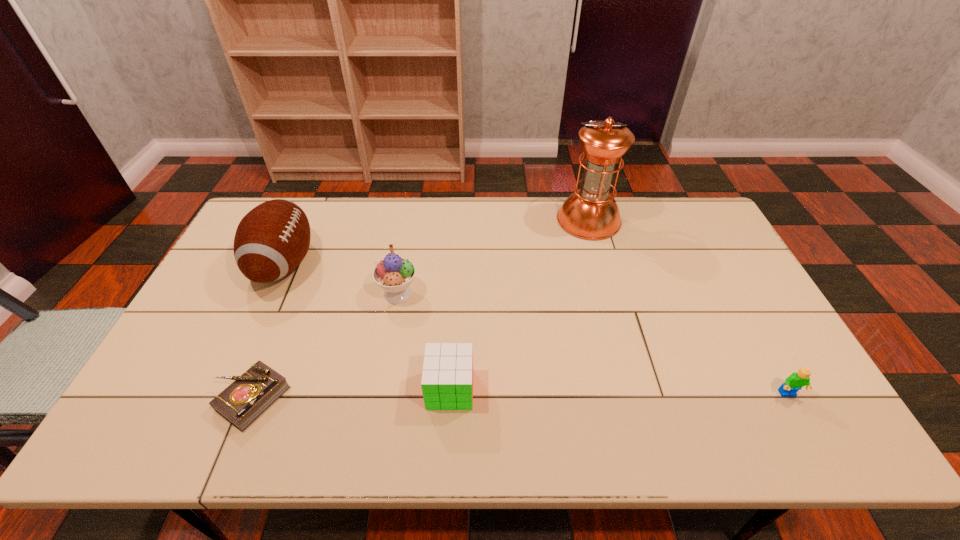
Where is `the second object from right to left`? The width and height of the screenshot is (960, 540). the second object from right to left is located at coordinates (591, 213).

Locate an element on the screen. the tallest object is located at coordinates (591, 213).

Image resolution: width=960 pixels, height=540 pixels. I want to click on football, so click(271, 240).

In order to click on the third tallest object in this screenshot , I will do `click(394, 274)`.

Find the location of `icecream`. icecream is located at coordinates (394, 274).

The height and width of the screenshot is (540, 960). I want to click on cube, so click(447, 378).

Locate an element on the screen. Lego is located at coordinates pyautogui.click(x=797, y=380).

Where is `diary`? diary is located at coordinates point(242,402).

This screenshot has height=540, width=960. In order to click on vacant space situated on the right of the tallest object in this screenshot , I will do [697, 220].

Where is `vacant point located on the laces of the fifth shortest object`? The width and height of the screenshot is (960, 540). vacant point located on the laces of the fifth shortest object is located at coordinates (351, 264).